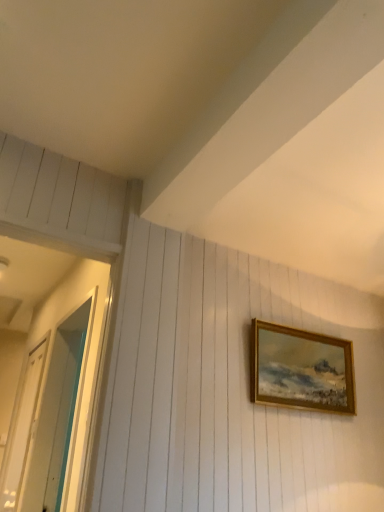
Identify the location of gold wooden picture frame at lower right. The image size is (384, 512). (301, 369).

Image resolution: width=384 pixels, height=512 pixels. What do you see at coordinates (301, 369) in the screenshot? I see `gold wooden picture frame at lower right` at bounding box center [301, 369].

Find the location of a particular element. This screenshot has height=512, width=384. gold wooden picture frame at lower right is located at coordinates (301, 369).